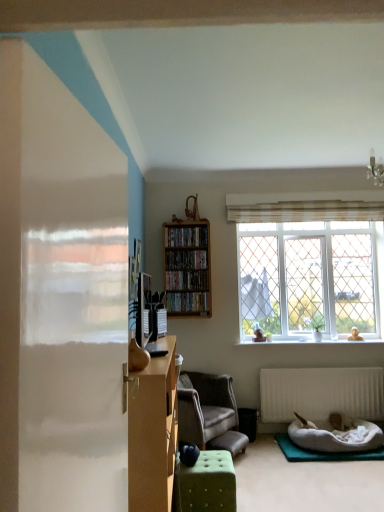
Question: Considering the relative sizes of green tufted ottoman at center and wooden bookshelf at upper center, the second cabinet in the bottom-to-top sequence, in the image provided, is green tufted ottoman at center thinner than wooden bookshelf at upper center, the second cabinet in the bottom-to-top sequence,?

Choices:
 (A) yes
 (B) no

Answer: (B)

Question: Is wooden bookshelf at upper center, which appears as the first cabinet when viewed from the top, inside green tufted ottoman at center?

Choices:
 (A) no
 (B) yes

Answer: (A)

Question: Can you confirm if green tufted ottoman at center is smaller than wooden bookshelf at upper center, which appears as the first cabinet when viewed from the top?

Choices:
 (A) no
 (B) yes

Answer: (A)

Question: Is green tufted ottoman at center not close to wooden bookshelf at upper center, the second cabinet in the bottom-to-top sequence?

Choices:
 (A) yes
 (B) no

Answer: (A)

Question: From a real-world perspective, is green tufted ottoman at center positioned under wooden bookshelf at upper center, the second cabinet in the bottom-to-top sequence, based on gravity?

Choices:
 (A) no
 (B) yes

Answer: (B)

Question: Is white glass window at upper right in front of or behind wooden bookshelf at center, placed as the 2th cabinet when sorted from top to bottom, in the image?

Choices:
 (A) behind
 (B) front

Answer: (A)

Question: Considering the relative positions of white glass window at upper right and wooden bookshelf at center, positioned as the 1th cabinet in bottom-to-top order, in the image provided, is white glass window at upper right to the left or to the right of wooden bookshelf at center, positioned as the 1th cabinet in bottom-to-top order,?

Choices:
 (A) left
 (B) right

Answer: (B)

Question: From the image's perspective, relative to wooden bookshelf at center, placed as the 2th cabinet when sorted from top to bottom, is white glass window at upper right above or below?

Choices:
 (A) below
 (B) above

Answer: (A)

Question: Choose the correct answer: Is white glass window at upper right inside wooden bookshelf at center, positioned as the 1th cabinet in bottom-to-top order, or outside it?

Choices:
 (A) inside
 (B) outside

Answer: (B)

Question: From their relative heights in the image, would you say white glass window at upper right is taller or shorter than wooden bookshelf at center, the 1th shelf from the bottom?

Choices:
 (A) tall
 (B) short

Answer: (A)

Question: From a real-world perspective, relative to wooden bookshelf at center, the 1th shelf from the bottom, is white glass window at upper right vertically above or below?

Choices:
 (A) above
 (B) below

Answer: (A)

Question: Is white glass window at upper right wider or thinner than wooden bookshelf at center, the 1th shelf from the bottom?

Choices:
 (A) wide
 (B) thin

Answer: (B)

Question: Is white glass window at upper right to the left or to the right of wooden bookshelf at center, the 3th shelf positioned from the top, in the image?

Choices:
 (A) left
 (B) right

Answer: (B)

Question: In terms of height, does white matte radiator at lower center look taller or shorter compared to wooden bookshelf at center, acting as the 2th shelf starting from the top?

Choices:
 (A) tall
 (B) short

Answer: (A)

Question: From a real-world perspective, is white matte radiator at lower center physically located above or below wooden bookshelf at center, acting as the 2th shelf starting from the top?

Choices:
 (A) below
 (B) above

Answer: (A)